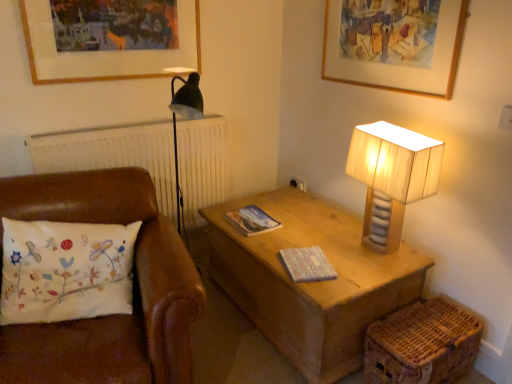
This screenshot has width=512, height=384. Identify the location of vacant region above wooden textured book at center, arranged as the first magazine when viewed from the right (from a real-world perspective). (305, 262).